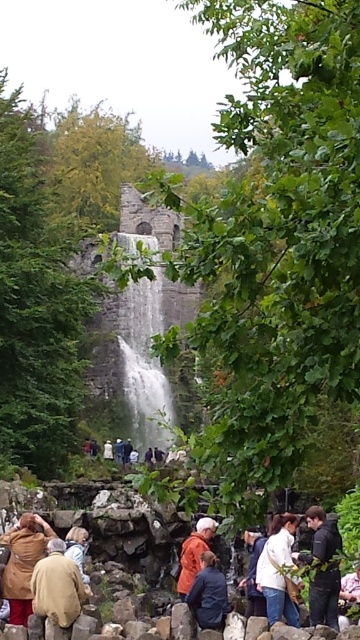
Question: Which is nearer to the dark blue jacket at center?

Choices:
 (A) white cotton shirt at center
 (B) white textured water at center

Answer: (A)

Question: Does orange fabric jacket at lower center appear on the left side of white cotton shirt at center?

Choices:
 (A) no
 (B) yes

Answer: (B)

Question: Which object is positioned farthest from the white cotton shirt at center?

Choices:
 (A) orange fabric jacket at lower center
 (B) dark blue jacket at center
 (C) white matte jacket at lower center

Answer: (B)

Question: Does brown woolen coat at lower left appear on the right side of white matte jacket at lower center?

Choices:
 (A) yes
 (B) no

Answer: (B)

Question: Among these objects, which one is nearest to the camera?

Choices:
 (A) white cotton shirt at center
 (B) dark brown leather jacket at lower center
 (C) beige fabric jacket at lower left
 (D) brown woolen coat at lower left

Answer: (C)

Question: Considering the relative positions of brown woolen coat at lower left and dark blue jacket at center in the image provided, where is brown woolen coat at lower left located with respect to dark blue jacket at center?

Choices:
 (A) below
 (B) above

Answer: (B)